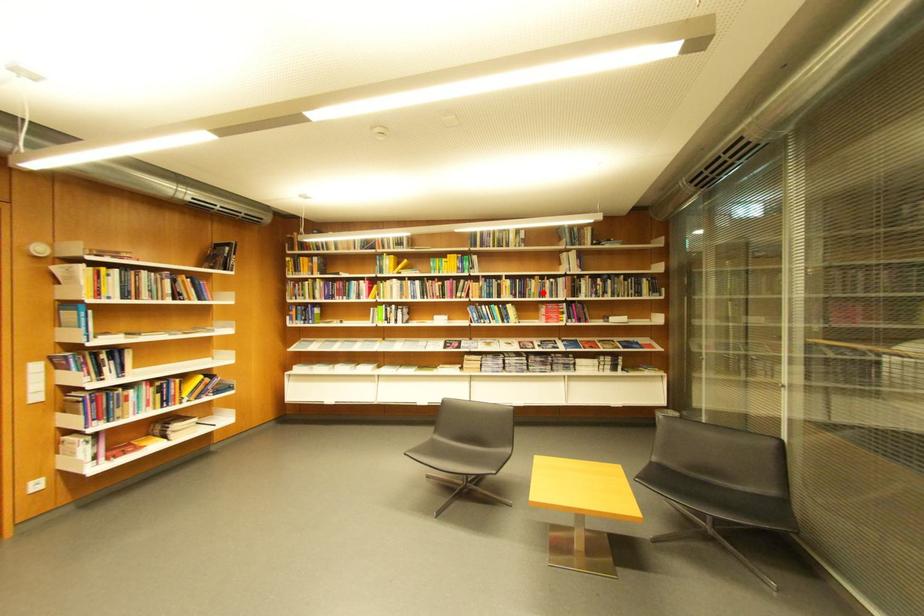
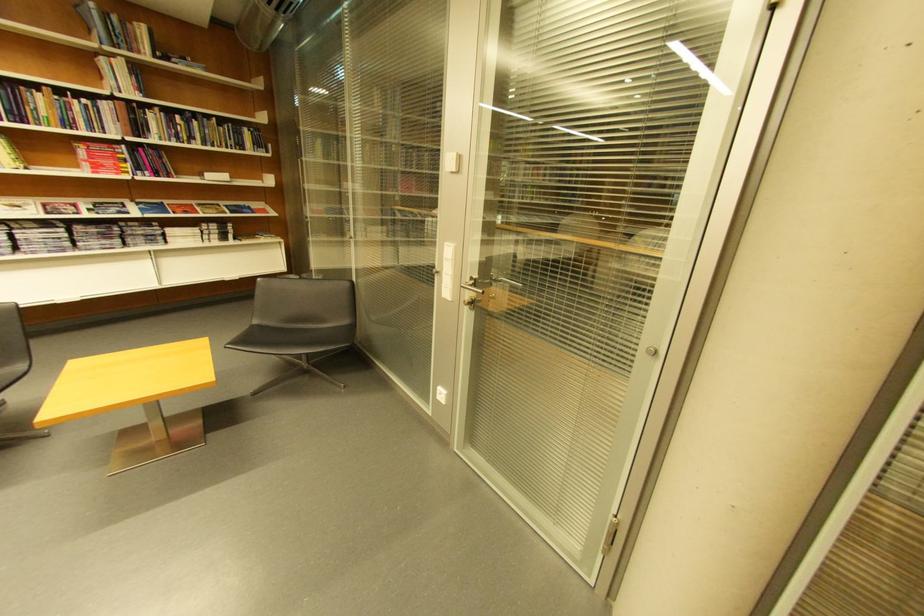
Where in the second image is the point corresponding to the highlighted location from the first image?

(54, 116)